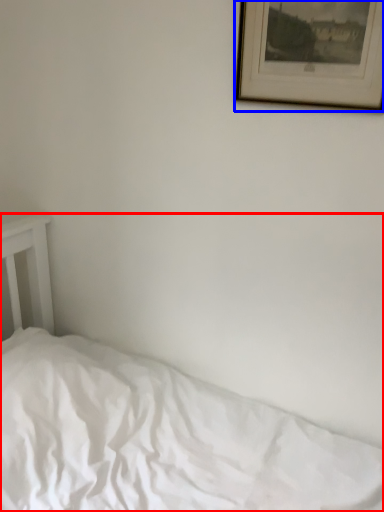
Question: Which point is further to the camera, bed (highlighted by a red box) or picture frame (highlighted by a blue box)?

Choices:
 (A) bed
 (B) picture frame

Answer: (B)